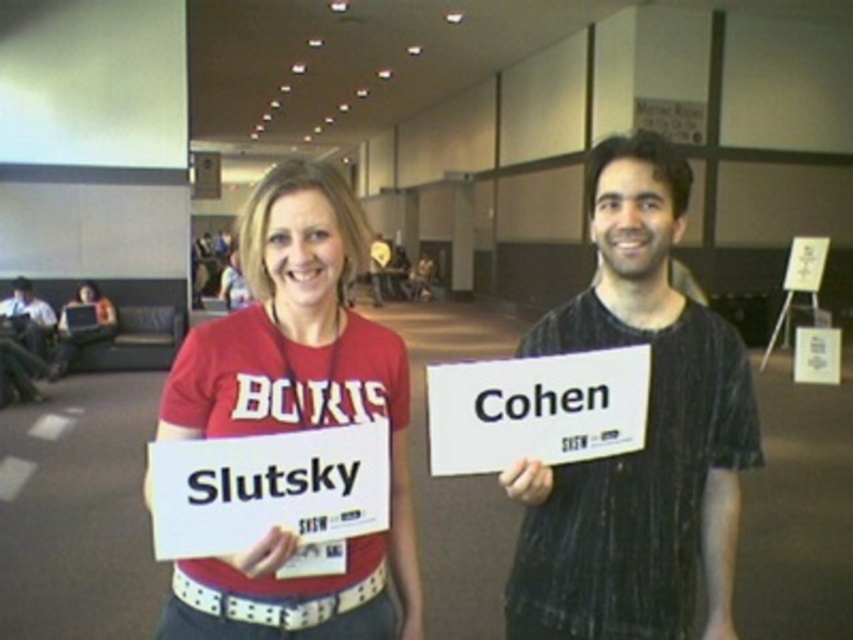
Is point (605, 497) behind point (62, 339)?

No, (605, 497) is in front of (62, 339).

Is black textured shirt at center positioned at the back of matte red shirt at center?

No.

Does point (579, 481) come behind point (99, 330)?

No, it is in front of (99, 330).

You are a GUI agent. You are given a task and a screenshot of the screen. Output one action in this format:
    pyautogui.click(x=<x>, y=<y>)
    Task: Click on the black textured shirt at center
    
    Given the screenshot: What is the action you would take?
    pyautogui.click(x=646, y=433)

Which is behind, point (358, 243) or point (61, 362)?

Positioned behind is point (61, 362).

Is point (360, 536) farther from viewer compared to point (85, 336)?

That is False.

Locate an element on the screen. This screenshot has width=853, height=640. matte red t-shirt at center is located at coordinates (294, 417).

Who is lower down, black textured shirt at center or matte red t-shirt at center?

black textured shirt at center

Who is taller, black textured shirt at center or matte red t-shirt at center?

With more height is black textured shirt at center.

Is point (704, 404) positioned behind point (329, 371)?

That is True.

What are the coordinates of `black textured shirt at center` in the screenshot? It's located at (646, 433).